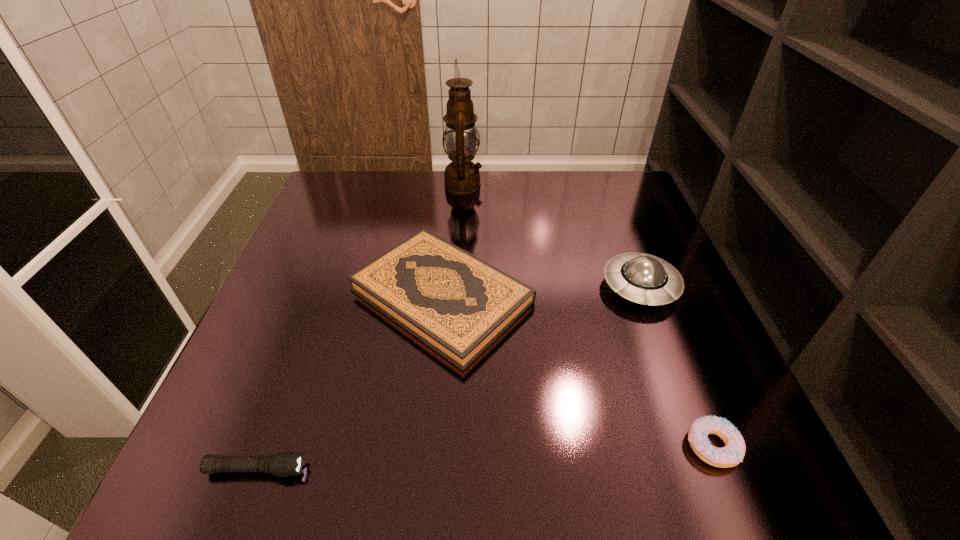
This screenshot has height=540, width=960. Identify the location of vacant area that satisfies the following two spatial constraints: 1. on the front side of the hardback book; 2. at the lens end of the flashlight. (426, 469).

Find the location of a particular element. The width and height of the screenshot is (960, 540). vacant space that satisfies the following two spatial constraints: 1. on the front side of the doughnut; 2. on the right side of the oil lamp is located at coordinates (449, 446).

Image resolution: width=960 pixels, height=540 pixels. I want to click on free location that satisfies the following two spatial constraints: 1. on the front side of the tallest object; 2. at the lens end of the flashlight, so (448, 469).